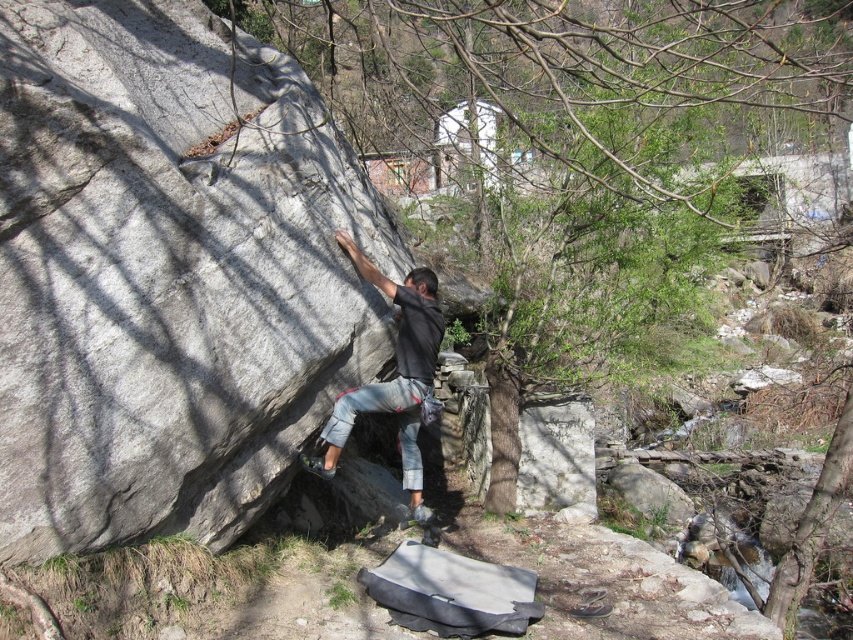
You are a rock climber assessing the climbing route. You see the gray rough rock at center and the dark gray stone climbing gear at center. Which object is positioned higher up the rock face?

The gray rough rock at center is located above the dark gray stone climbing gear at center, so the gray rough rock at center is positioned higher up the rock face.